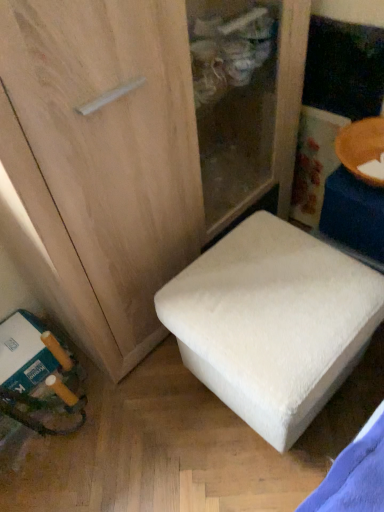
Question: Should I look upward or downward to see white fluffy ottoman at center?

Choices:
 (A) up
 (B) down

Answer: (B)